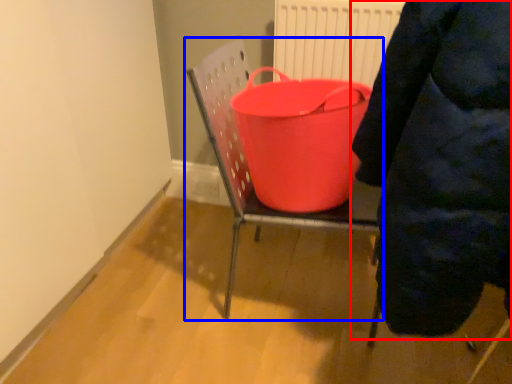
Question: Among these objects, which one is nearest to the camera, person (highlighted by a red box) or furniture (highlighted by a blue box)?

Choices:
 (A) person
 (B) furniture

Answer: (A)